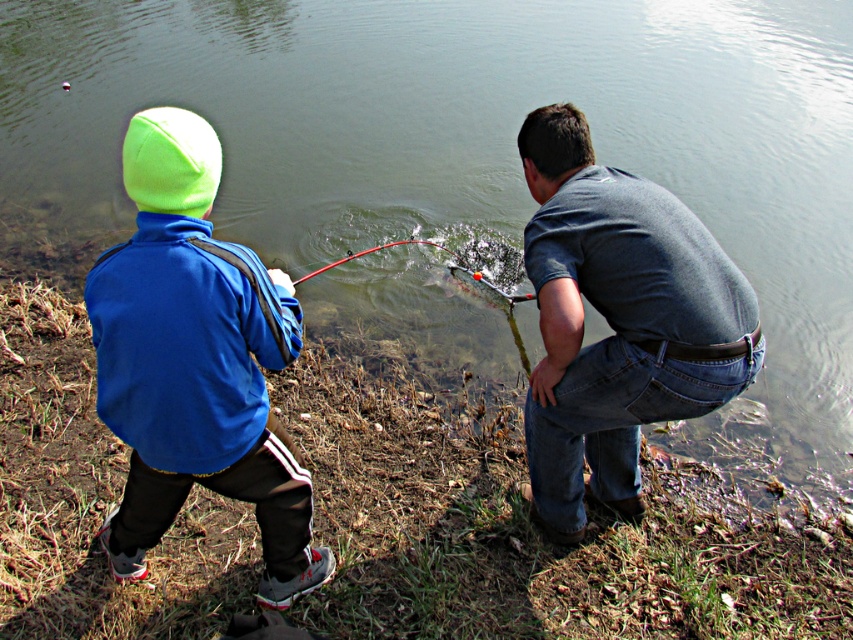
Looking at this image, who is lower down, matte blue jacket at left or blue fleece jacket at left?

matte blue jacket at left

In the scene shown: Measure the distance between matte blue jacket at left and camera.

They are 7.30 feet apart.

At what (x,y) coordinates should I click in order to perform the action: click on matte blue jacket at left. Please return your answer as a coordinate pair (x, y). Image resolution: width=853 pixels, height=640 pixels. Looking at the image, I should click on (195, 362).

Find the location of `matte blue jacket at left`. matte blue jacket at left is located at coordinates (195, 362).

Measure the distance from denim jeans at lower right to blue fleece jacket at left.

The distance of denim jeans at lower right from blue fleece jacket at left is 1.15 meters.

Does point (624, 486) come closer to viewer compared to point (155, 214)?

No, it is not.

Is point (631, 412) closer to viewer compared to point (216, 452)?

No, it is not.

At what (x,y) coordinates should I click in order to perform the action: click on denim jeans at lower right. Please return your answer as a coordinate pair (x, y). The image size is (853, 640). Looking at the image, I should click on 618,321.